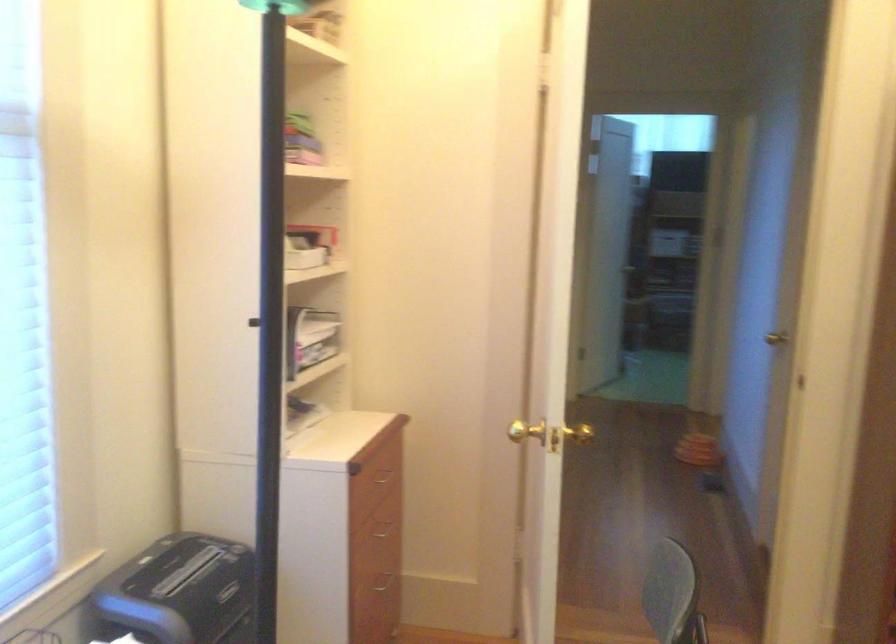
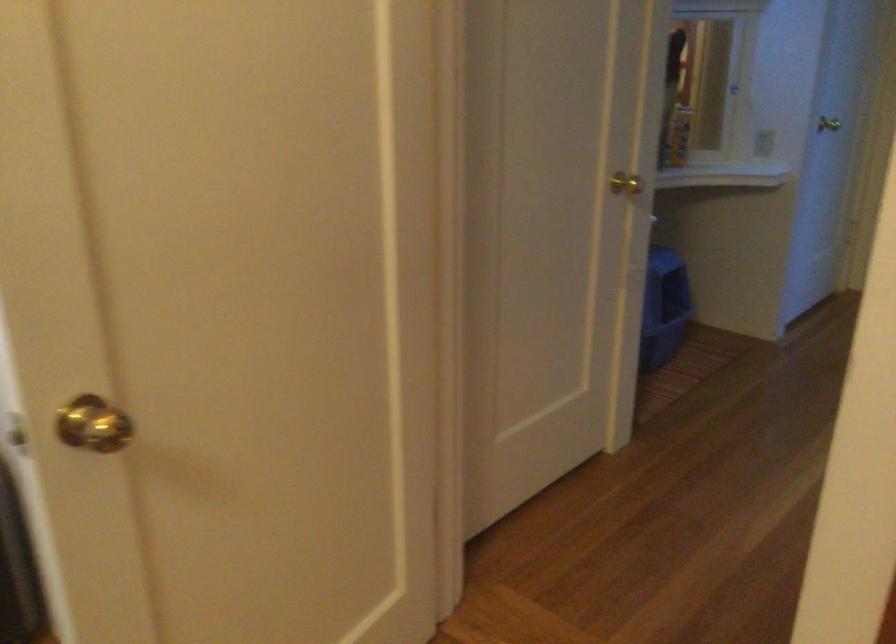
Question: I am providing you with two images of the same scene from different viewpoints. Which of the following objects are not visible in image2?

Choices:
 (A) drawer handle
 (B) light switch
 (C) white sliding door handle
 (D) blue litter box

Answer: (A)